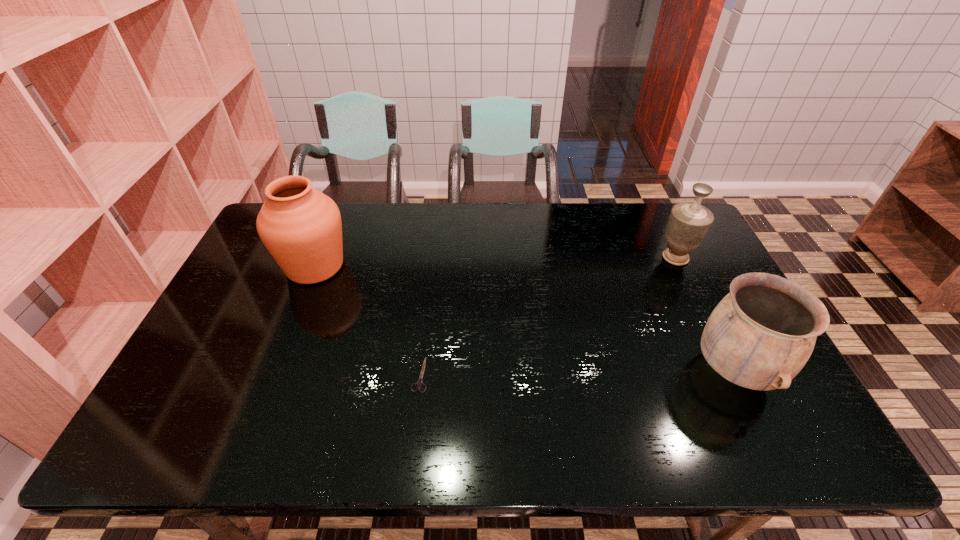
Identify the location of free space between the nearest urn and the third object from right to left. [x=577, y=373].

The image size is (960, 540). Find the location of `object that can be found as the closest to the nearest urn`. object that can be found as the closest to the nearest urn is located at coordinates (x=689, y=222).

The image size is (960, 540). Identify the location of object that is the closest to the nearest urn. 689,222.

Find the location of a particular element. urn that is the second closest to the nearest urn is located at coordinates (301, 227).

Select which urn is the closest to the shears. Please provide its 2D coordinates. Your answer should be formatted as a tuple, i.e. [(x, y)], where the tuple contains the x and y coordinates of a point satisfying the conditions above.

[(301, 227)]

I want to click on free spot that satisfies the following two spatial constraints: 1. on the front side of the nearest urn; 2. on the left side of the leftmost object, so click(274, 370).